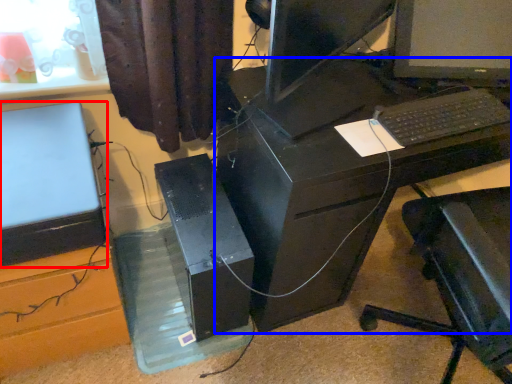
Question: Which object is further to the camera taking this photo, computer (highlighted by a red box) or desk (highlighted by a blue box)?

Choices:
 (A) computer
 (B) desk

Answer: (B)